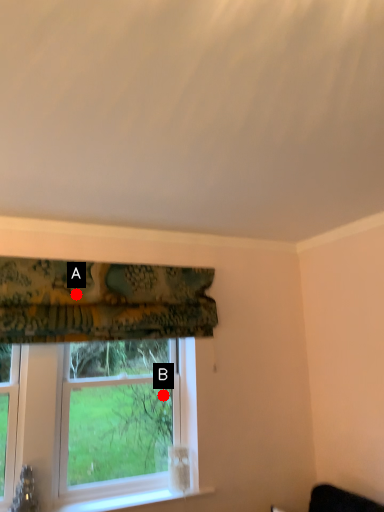
Question: Two points are circled on the image, labeled by A and B beside each circle. Which of the following is the closest to the observer?

Choices:
 (A) A is closer
 (B) B is closer

Answer: (A)